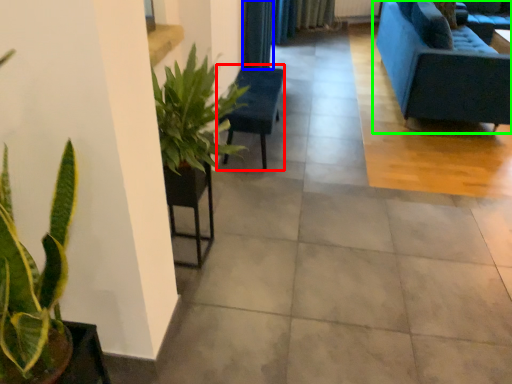
Question: Which object is the farthest from armchair (highlighted by a red box)? Choose among these: curtain (highlighted by a blue box) or studio couch (highlighted by a green box).

Choices:
 (A) curtain
 (B) studio couch

Answer: (B)